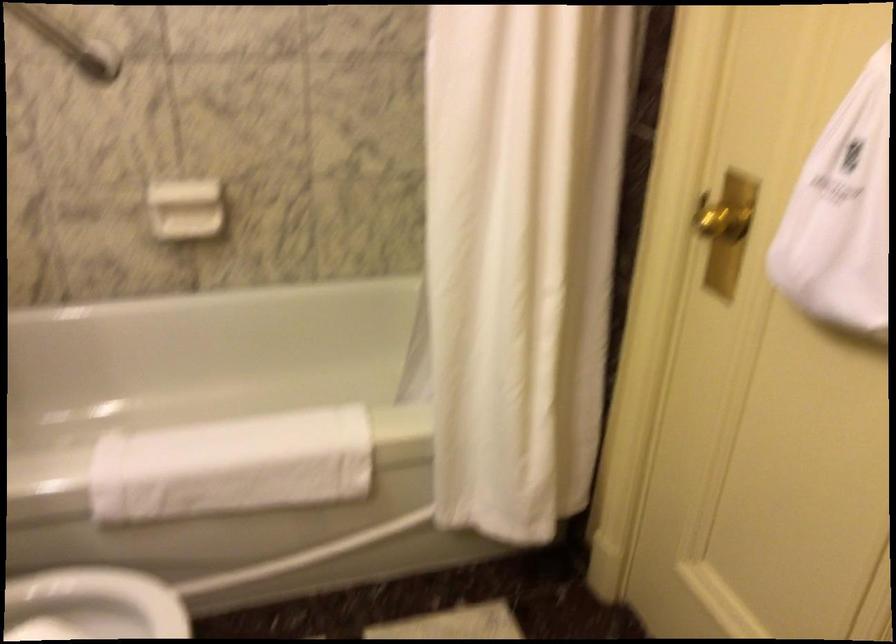
The location [231,466] corresponds to which object?

This point indicates the white folded towel.